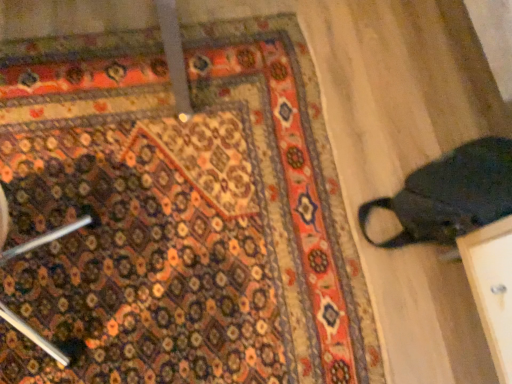
The image size is (512, 384). Find the location of `free space between dark fabric bag at right and carpeted mat at lower left`. free space between dark fabric bag at right and carpeted mat at lower left is located at coordinates (393, 169).